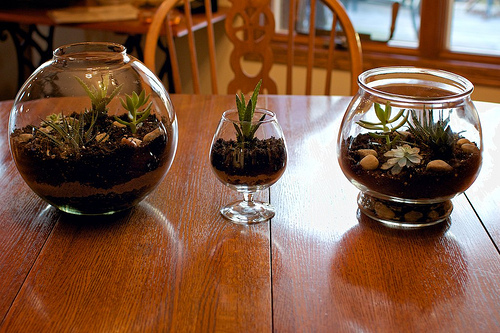
Find the location of a particular element. The height and width of the screenshot is (333, 500). soil in terrariums is located at coordinates (109, 177), (415, 188), (257, 166).